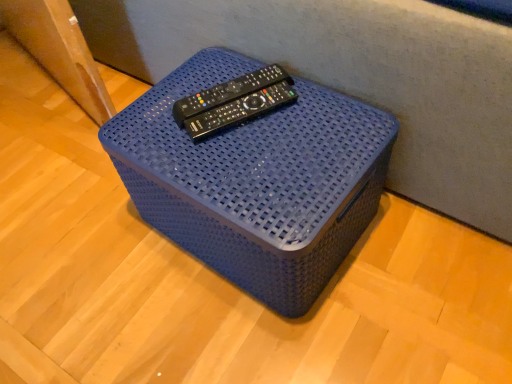
I want to click on vacant area that is situated to the right of black plastic remote at center, so click(327, 106).